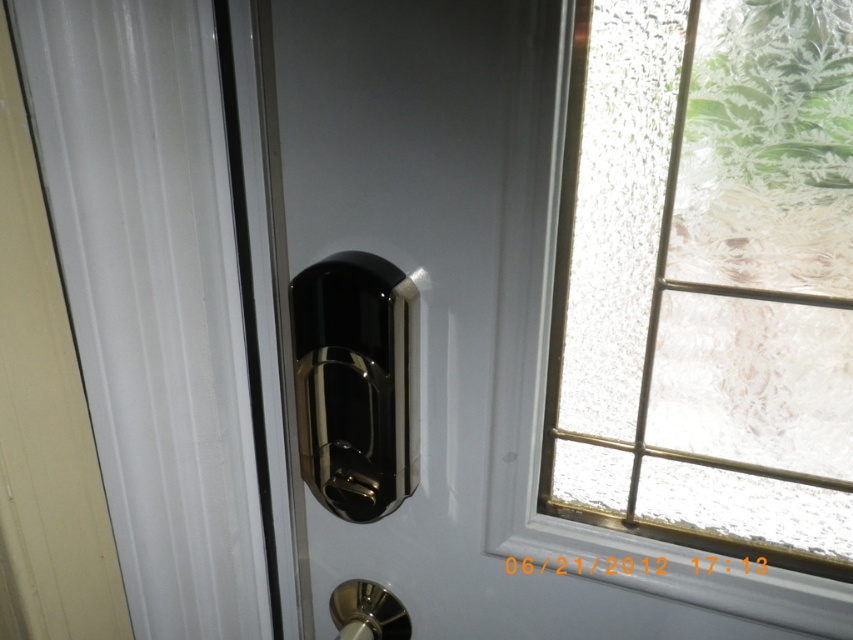
Question: Does glossy metallic lock at center come in front of glossy metallic door handle at center?

Choices:
 (A) no
 (B) yes

Answer: (B)

Question: Does frosted glass window at upper right appear on the left side of polished metal door handle at lower center?

Choices:
 (A) yes
 (B) no

Answer: (B)

Question: Which object is positioned farthest from the glossy metallic door handle at center?

Choices:
 (A) frosted glass window at upper right
 (B) polished metal door handle at lower center
 (C) glossy metallic lock at center

Answer: (B)

Question: Estimate the real-world distances between objects in this image. Which object is closer to the polished metal door handle at lower center?

Choices:
 (A) frosted glass window at upper right
 (B) glossy metallic door handle at center

Answer: (B)

Question: Which of the following is the farthest from the observer?

Choices:
 (A) glossy metallic door handle at center
 (B) glossy metallic lock at center

Answer: (A)

Question: Observing the image, what is the correct spatial positioning of glossy metallic lock at center in reference to frosted glass window at upper right?

Choices:
 (A) left
 (B) right

Answer: (A)